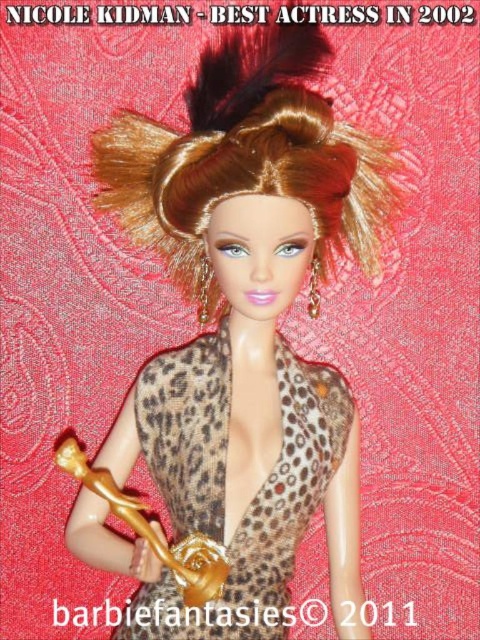
Question: Is shiny brown hair at center further to camera compared to leopard print fabric dress at center?

Choices:
 (A) no
 (B) yes

Answer: (A)

Question: Among these objects, which one is farthest from the camera?

Choices:
 (A) leopard print fabric dress at center
 (B) shiny brown hair at center

Answer: (A)

Question: Does shiny brown hair at center have a lesser width compared to leopard print fabric dress at center?

Choices:
 (A) no
 (B) yes

Answer: (A)

Question: Which of the following is the closest to the observer?

Choices:
 (A) shiny brown hair at center
 (B) leopard print fabric dress at center

Answer: (A)

Question: Does shiny brown hair at center have a greater width compared to leopard print fabric dress at center?

Choices:
 (A) yes
 (B) no

Answer: (A)